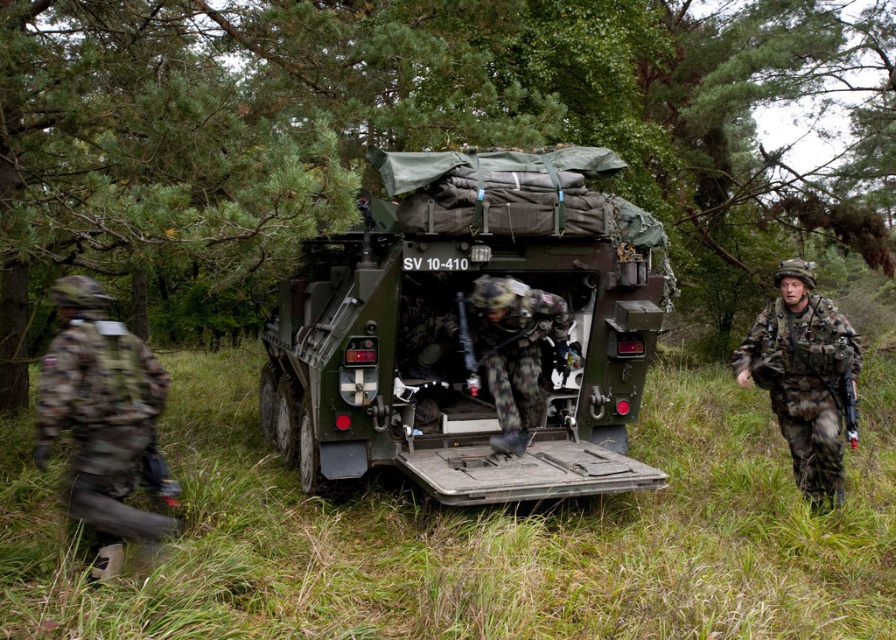
Question: Which of the following is the farthest from the observer?

Choices:
 (A) (88, 316)
 (B) (527, 372)

Answer: (B)

Question: Is green grassy at center bigger than camouflage fabric armored personnel carrier at center?

Choices:
 (A) no
 (B) yes

Answer: (B)

Question: From the image, what is the correct spatial relationship of camouflage fabric uniform at right in relation to camouflage fabric uniform at center?

Choices:
 (A) above
 (B) below

Answer: (B)

Question: Which of the following is the closest to the observer?

Choices:
 (A) (225, 376)
 (B) (536, 300)

Answer: (B)

Question: Does camouflage fabric uniform at left appear over camouflage fabric uniform at right?

Choices:
 (A) yes
 (B) no

Answer: (B)

Question: Estimate the real-world distances between objects in this image. Which object is farther from the camouflage fabric uniform at left?

Choices:
 (A) green grassy at center
 (B) camouflage fabric uniform at center
 (C) camouflage fabric uniform at right
 (D) camouflage fabric armored personnel carrier at center

Answer: (C)